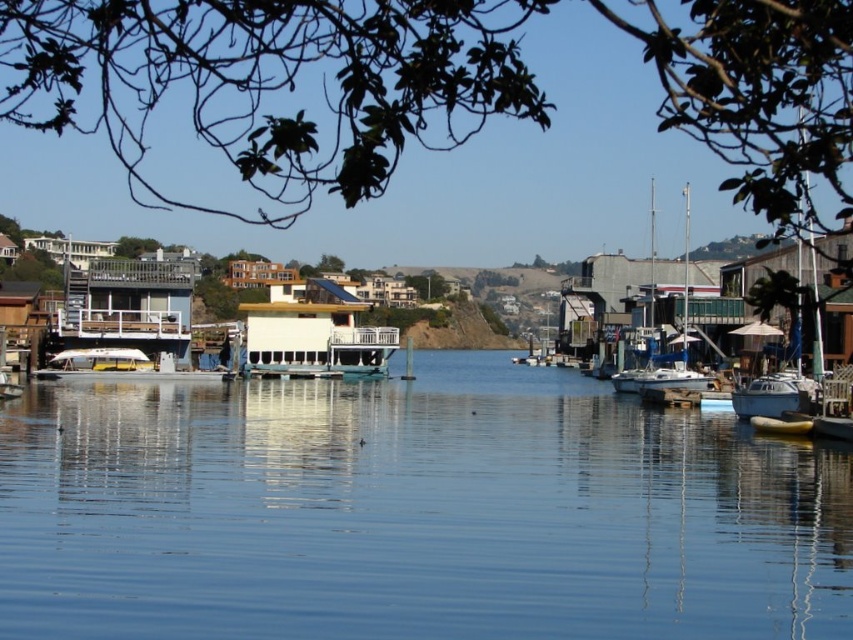
Question: Which object is closer to the camera taking this photo?

Choices:
 (A) white glossy boat at left
 (B) clear blue water at center

Answer: (B)

Question: Is white glossy boat at left smaller than white matte sailboat at center-right?

Choices:
 (A) yes
 (B) no

Answer: (A)

Question: Which object appears farthest from the camera in this image?

Choices:
 (A) white matte sailboat at center-right
 (B) clear blue water at center
 (C) white glossy boat at left

Answer: (A)

Question: Considering the real-world distances, which object is farthest from the white glossy boat at left?

Choices:
 (A) white matte sailboat at center-right
 (B) clear blue water at center

Answer: (A)

Question: Can you confirm if white glossy boat at left is smaller than white matte sailboat at center-right?

Choices:
 (A) yes
 (B) no

Answer: (A)

Question: Can you confirm if white glossy boat at left is bigger than white matte sailboat at center-right?

Choices:
 (A) no
 (B) yes

Answer: (A)